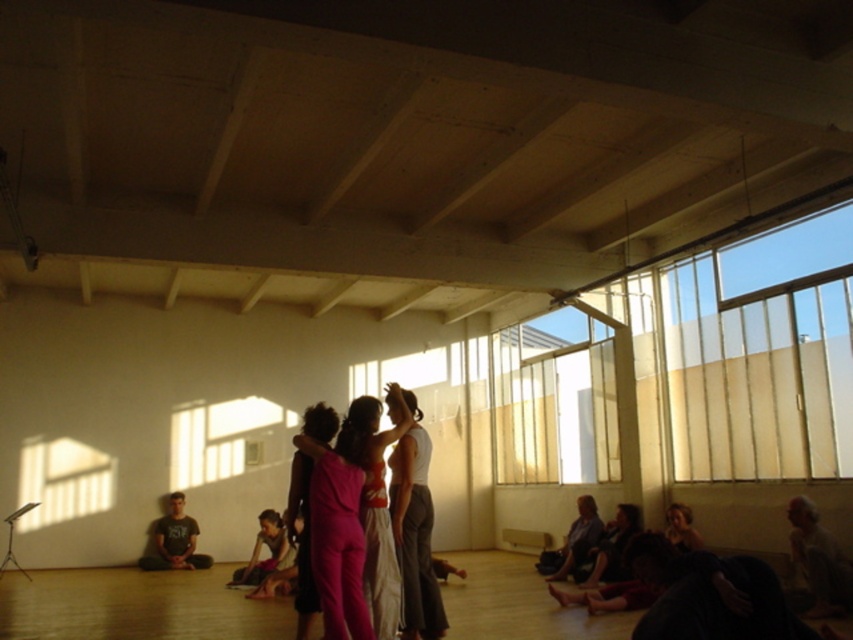
Question: Can you confirm if pink fabric dress at center is positioned to the right of dark purple fabric at lower right?

Choices:
 (A) no
 (B) yes

Answer: (A)

Question: Can you confirm if translucent glass window at lower left is positioned to the right of smooth brown hair at lower right?

Choices:
 (A) yes
 (B) no

Answer: (B)

Question: Can you confirm if dark gray t-shirt at lower left is bigger than smooth brown hair at lower right?

Choices:
 (A) yes
 (B) no

Answer: (A)

Question: Which point is farther to the camera?

Choices:
 (A) (685, 545)
 (B) (412, 442)
 (C) (616, 451)

Answer: (C)

Question: Among these objects, which one is nearest to the camera?

Choices:
 (A) translucent glass window at lower left
 (B) transparent glass window at upper center

Answer: (B)

Question: Estimate the real-world distances between objects in this image. Which object is closer to the transparent glass window at upper center?

Choices:
 (A) pink fabric dress at center
 (B) dark gray t-shirt at lower left
 (C) smooth brown hair at lower right

Answer: (C)